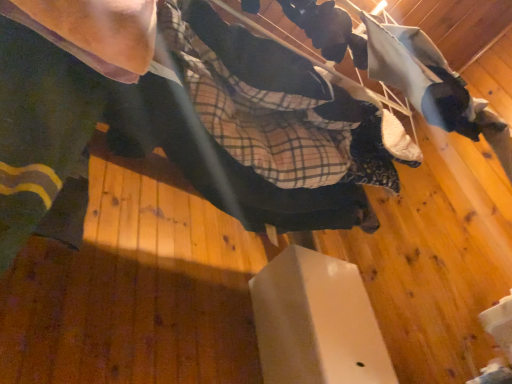
Question: Is fluffy white blanket at upper right in contact with matte black skateboard at center?

Choices:
 (A) yes
 (B) no

Answer: (B)

Question: Can you confirm if fluffy white blanket at upper right is wider than matte black skateboard at center?

Choices:
 (A) yes
 (B) no

Answer: (B)

Question: From a real-world perspective, is fluffy white blanket at upper right under matte black skateboard at center?

Choices:
 (A) yes
 (B) no

Answer: (B)

Question: Is fluffy white blanket at upper right not close to matte black skateboard at center?

Choices:
 (A) yes
 (B) no

Answer: (B)

Question: Is fluffy white blanket at upper right to the right of matte black skateboard at center from the viewer's perspective?

Choices:
 (A) no
 (B) yes

Answer: (B)

Question: Do you think fluffy white blanket at upper right is within white matte box at center, or outside of it?

Choices:
 (A) outside
 (B) inside

Answer: (A)

Question: Looking at the image, does fluffy white blanket at upper right seem bigger or smaller compared to white matte box at center?

Choices:
 (A) small
 (B) big

Answer: (A)

Question: Considering the positions of fluffy white blanket at upper right and white matte box at center in the image, is fluffy white blanket at upper right taller or shorter than white matte box at center?

Choices:
 (A) tall
 (B) short

Answer: (B)

Question: From a real-world perspective, relative to white matte box at center, is fluffy white blanket at upper right vertically above or below?

Choices:
 (A) below
 (B) above

Answer: (B)

Question: From a real-world perspective, is white matte box at center physically located above or below matte black skateboard at center?

Choices:
 (A) below
 (B) above

Answer: (A)

Question: In terms of width, does white matte box at center look wider or thinner when compared to matte black skateboard at center?

Choices:
 (A) wide
 (B) thin

Answer: (A)

Question: From the image's perspective, relative to matte black skateboard at center, is white matte box at center above or below?

Choices:
 (A) above
 (B) below

Answer: (B)

Question: In terms of height, does white matte box at center look taller or shorter compared to matte black skateboard at center?

Choices:
 (A) short
 (B) tall

Answer: (B)

Question: Visually, is white matte box at center positioned to the left or to the right of fluffy white blanket at upper right?

Choices:
 (A) right
 (B) left

Answer: (B)

Question: Is white matte box at center bigger or smaller than fluffy white blanket at upper right?

Choices:
 (A) small
 (B) big

Answer: (B)